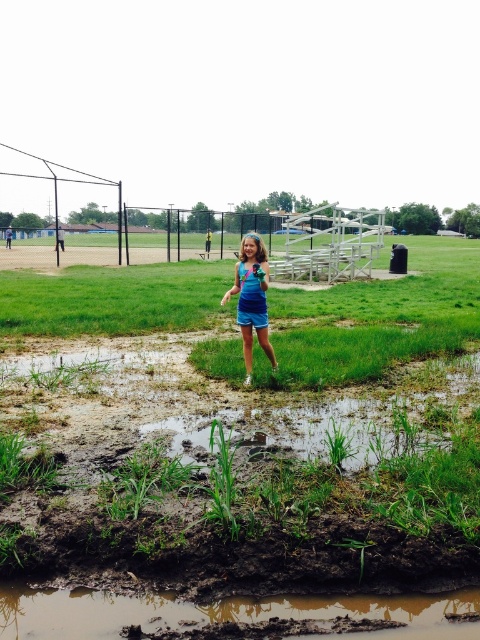
Can you confirm if green grass at center is positioned to the right of matte blue dress at center?

Yes, green grass at center is to the right of matte blue dress at center.

Is green grass at center shorter than matte blue dress at center?

In fact, green grass at center may be taller than matte blue dress at center.

Does point (232, 545) come behind point (243, 326)?

No, (232, 545) is closer to viewer.

Where is `green grass at center`? Image resolution: width=480 pixels, height=640 pixels. green grass at center is located at coordinates (252, 451).

What do you see at coordinates (252, 451) in the screenshot?
I see `green grass at center` at bounding box center [252, 451].

Which is below, green grass at center or muddy water at lower center?

muddy water at lower center is below.

You are a GUI agent. You are given a task and a screenshot of the screen. Output one action in this format:
    pyautogui.click(x=<x>, y=<y>)
    Task: Click on the green grass at center
    The width and height of the screenshot is (480, 640).
    Given the screenshot: What is the action you would take?
    tap(252, 451)

Does point (54, 621) come in front of point (252, 296)?

Yes, point (54, 621) is closer to viewer.

Is muddy water at lower center taller than matte blue dress at center?

Incorrect, muddy water at lower center's height is not larger of matte blue dress at center's.

Measure the distance between point (137,618) and camera.

3.51 meters

Image resolution: width=480 pixels, height=640 pixels. I want to click on muddy water at lower center, so click(223, 612).